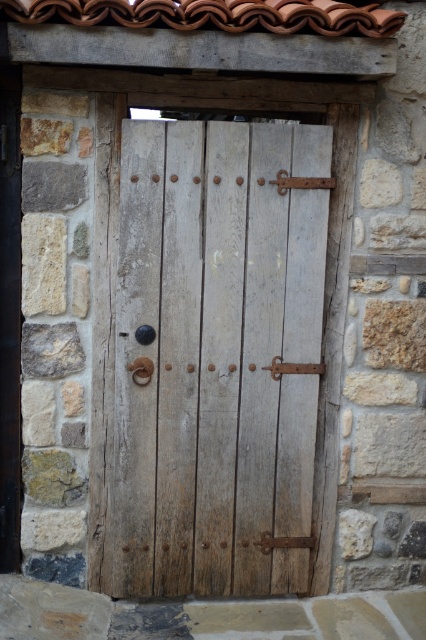
Can you confirm if weathered wood door at center is taller than terracotta clay tiles at upper center?

Indeed, weathered wood door at center has a greater height compared to terracotta clay tiles at upper center.

Image resolution: width=426 pixels, height=640 pixels. What do you see at coordinates (212, 356) in the screenshot?
I see `weathered wood door at center` at bounding box center [212, 356].

Where is `weathered wood door at center`? The width and height of the screenshot is (426, 640). weathered wood door at center is located at coordinates (212, 356).